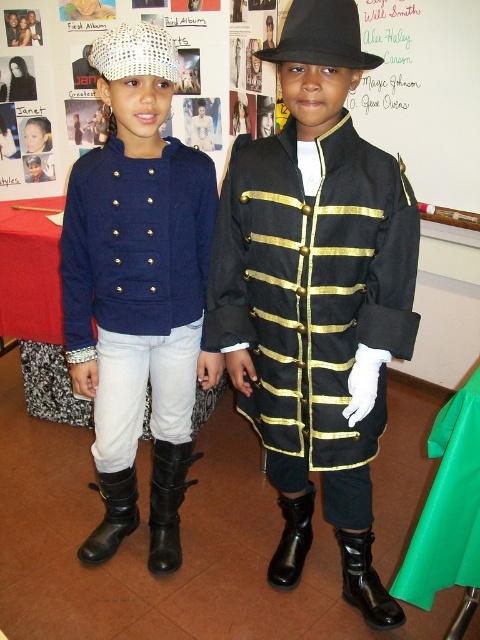
Is black matte coat at center bigger than black leather boot at lower center?

Indeed, black matte coat at center has a larger size compared to black leather boot at lower center.

I want to click on black matte coat at center, so click(317, 285).

Where is `black matte coat at center`? The image size is (480, 640). black matte coat at center is located at coordinates (317, 285).

Who is shorter, black matte coat at center or white woven hat at upper left?

white woven hat at upper left

Who is higher up, black matte coat at center or white woven hat at upper left?

Positioned higher is white woven hat at upper left.

Locate an element on the screen. The width and height of the screenshot is (480, 640). black matte coat at center is located at coordinates point(317,285).

The width and height of the screenshot is (480, 640). In order to click on black matte coat at center in this screenshot , I will do 317,285.

Is white paper at upper center shorter than black leather boot at lower left?

Incorrect, white paper at upper center's height does not fall short of black leather boot at lower left's.

Can you confirm if white paper at upper center is positioned to the right of black leather boot at lower left?

In fact, white paper at upper center is to the left of black leather boot at lower left.

Describe the element at coordinates (95, 80) in the screenshot. This screenshot has width=480, height=640. I see `white paper at upper center` at that location.

The image size is (480, 640). In order to click on white paper at upper center in this screenshot , I will do `click(95, 80)`.